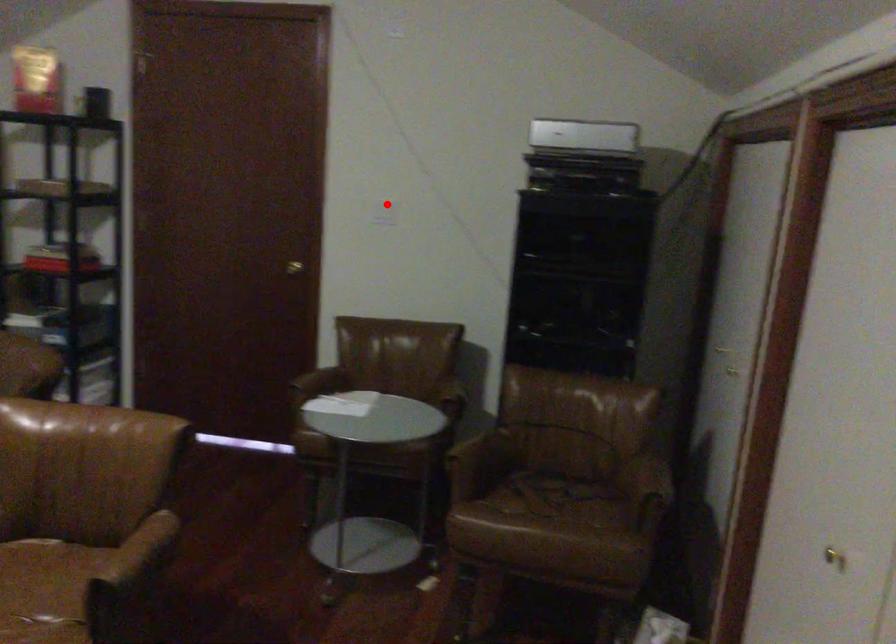
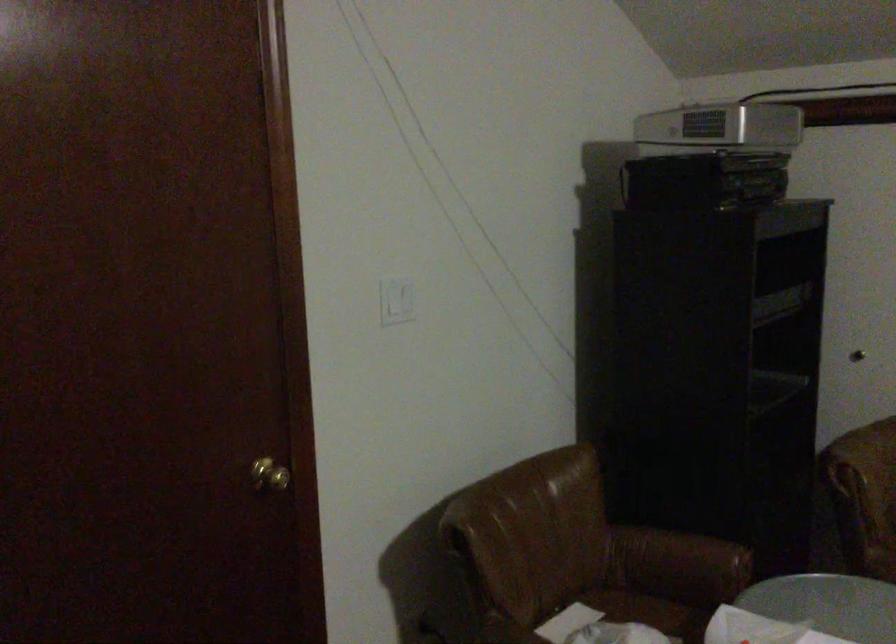
Question: I am providing you with two images of the same scene from different viewpoints. A red point is marked on the first image. At the location where the point appears in image 1, is it still visible in image 2?

Choices:
 (A) Yes
 (B) No

Answer: (A)